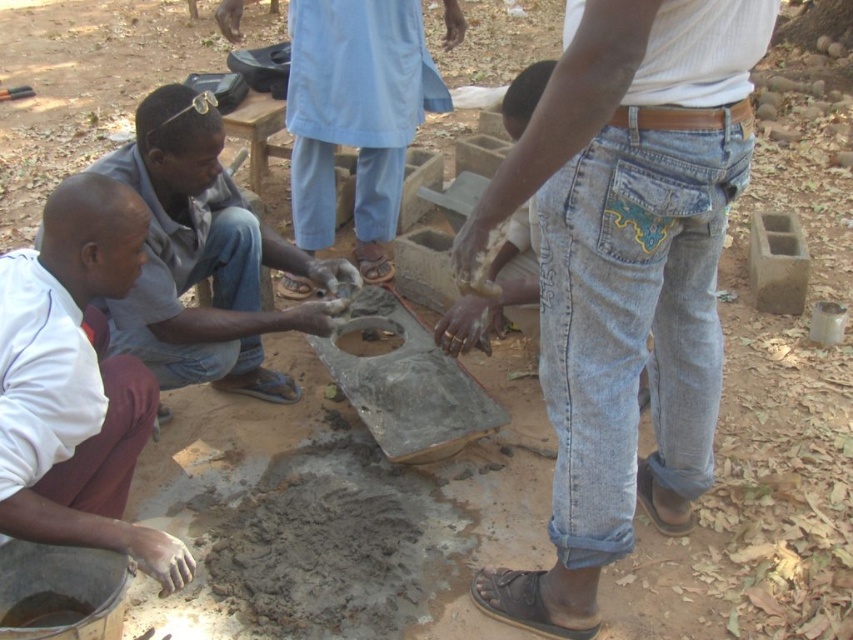
Between white fabric shirt at lower left and matte gray concrete at center, which one has less height?

Standing shorter between the two is matte gray concrete at center.

The image size is (853, 640). I want to click on white fabric shirt at lower left, so click(x=76, y=384).

What do you see at coordinates (76, 384) in the screenshot?
I see `white fabric shirt at lower left` at bounding box center [76, 384].

Locate an element on the screen. This screenshot has height=640, width=853. white fabric shirt at lower left is located at coordinates (76, 384).

Identify the location of denim jeans at center. (624, 273).

From the picture: Is denim jeans at center shorter than white fabric shirt at lower left?

No, denim jeans at center is not shorter than white fabric shirt at lower left.

The height and width of the screenshot is (640, 853). Identify the location of denim jeans at center. (624, 273).

Who is positioned more to the left, denim jeans at center or blue denim jeans at center?

Positioned to the left is blue denim jeans at center.

Is point (561, 529) closer to camera compared to point (498, 326)?

Yes.

Locate an element on the screen. denim jeans at center is located at coordinates (624, 273).